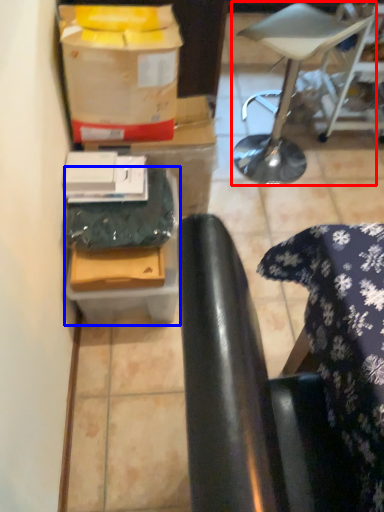
Question: Which object is further to the camera taking this photo, furniture (highlighted by a red box) or cardboard box (highlighted by a blue box)?

Choices:
 (A) furniture
 (B) cardboard box

Answer: (A)